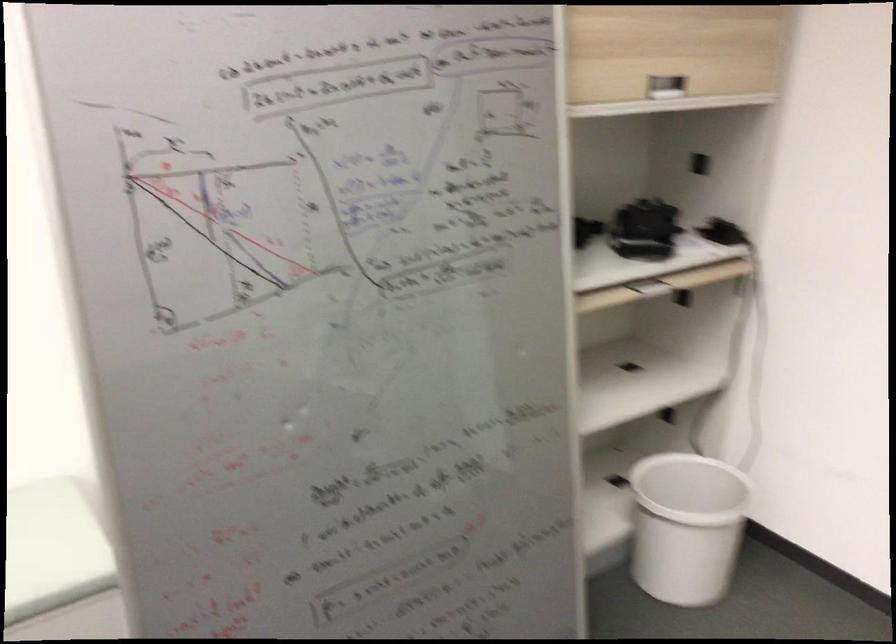
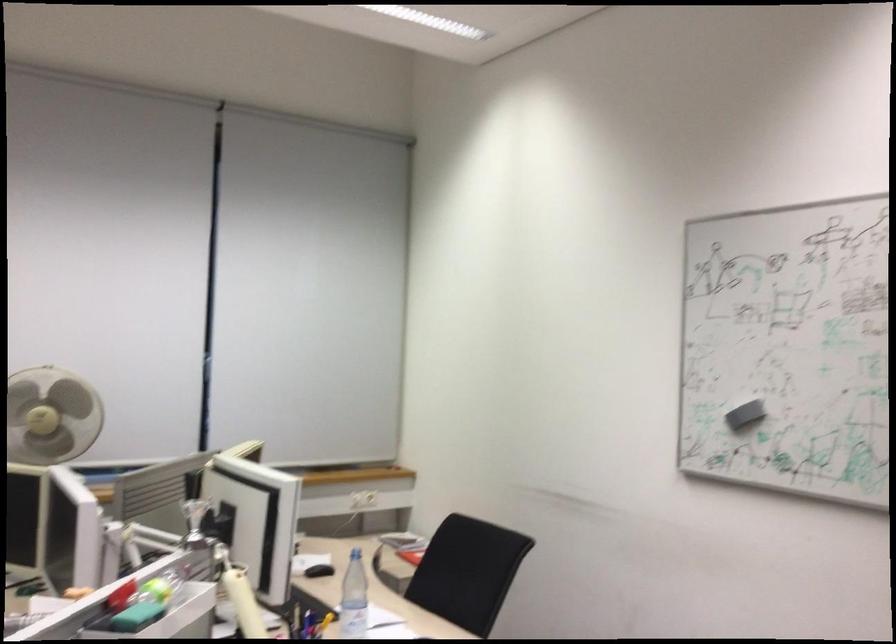
Question: Based on the continuous images, in which direction is the camera rotating? Reply with the corresponding letter.

Choices:
 (A) Left
 (B) Right
 (C) Up
 (D) Down

Answer: (A)